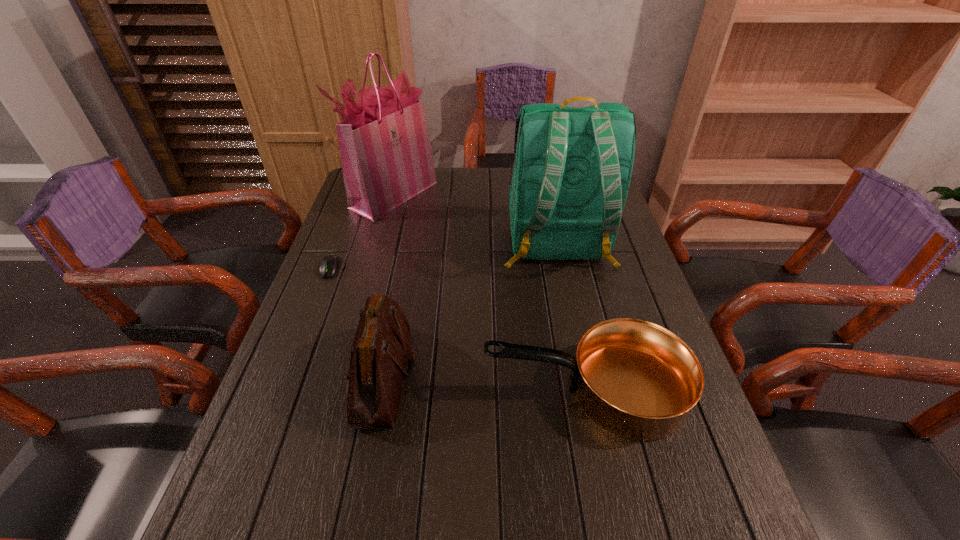
At what (x,y) coordinates should I click in order to perform the action: click on free space that is in between the shortest object and the third tallest object. Please return your answer as a coordinate pair (x, y). This screenshot has width=960, height=540. Looking at the image, I should click on (357, 322).

Identify the location of unoccupied position between the backpack and the third shortest object. Image resolution: width=960 pixels, height=540 pixels. (470, 310).

Locate an element on the screen. This screenshot has height=540, width=960. object that is the third closest to the shoulder bag is located at coordinates (569, 181).

This screenshot has height=540, width=960. Find the location of `object that is the fourth closest to the shopping bag`. object that is the fourth closest to the shopping bag is located at coordinates (635, 379).

This screenshot has width=960, height=540. I want to click on vacant space that satisfies the following two spatial constraints: 1. on the wheel side of the computer mouse; 2. on the right side of the shoulder bag, so [289, 376].